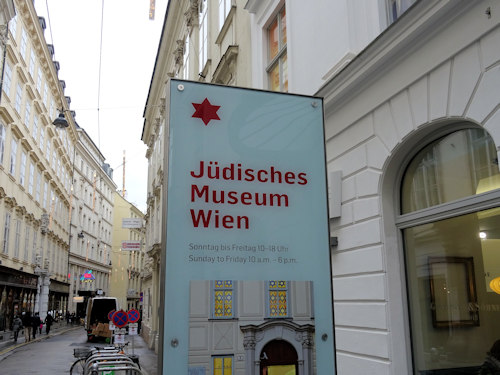
At what (x,y) coordinates should I click in order to perform the action: click on arched window of museum. Please return your answer as a coordinate pair (x, y). This screenshot has height=375, width=500. Looking at the image, I should click on (464, 287).